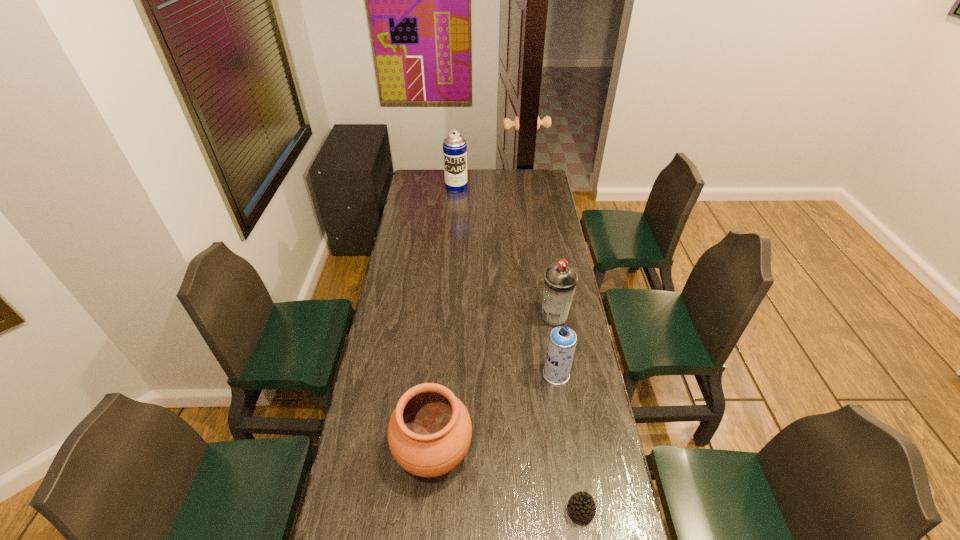
Find the location of a particular element. the leftmost aerosol can is located at coordinates (454, 145).

The width and height of the screenshot is (960, 540). Identify the location of the farthest object. click(x=454, y=145).

Where is `the fourth nearest object`? the fourth nearest object is located at coordinates (560, 281).

This screenshot has width=960, height=540. Identify the location of the second nearest aerosol can. (560, 281).

Where is `the fourth farthest object`? The image size is (960, 540). the fourth farthest object is located at coordinates (429, 433).

Image resolution: width=960 pixels, height=540 pixels. What are the coordinates of `the shortest aerosol can` in the screenshot? It's located at (562, 341).

Identify the location of the nearest aerosol can. This screenshot has height=540, width=960. (562, 341).

You are a GUI agent. You are given a task and a screenshot of the screen. Output one action in this format:
    pyautogui.click(x=<x>, y=<y>)
    Task: Click on the pinecone
    
    Given the screenshot: What is the action you would take?
    pyautogui.click(x=581, y=505)

In order to click on the nearest object in this screenshot , I will do `click(581, 505)`.

Locate an element on the screen. The height and width of the screenshot is (540, 960). free space located 0.400m on the label side of the farthest aerosol can is located at coordinates (453, 237).